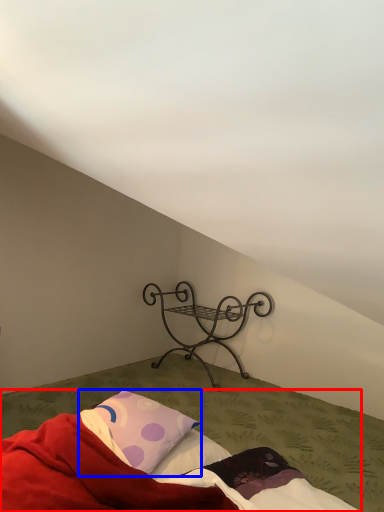
Question: Which of the following is the closest to the observer, bed (highlighted by a red box) or pillow (highlighted by a blue box)?

Choices:
 (A) bed
 (B) pillow

Answer: (A)